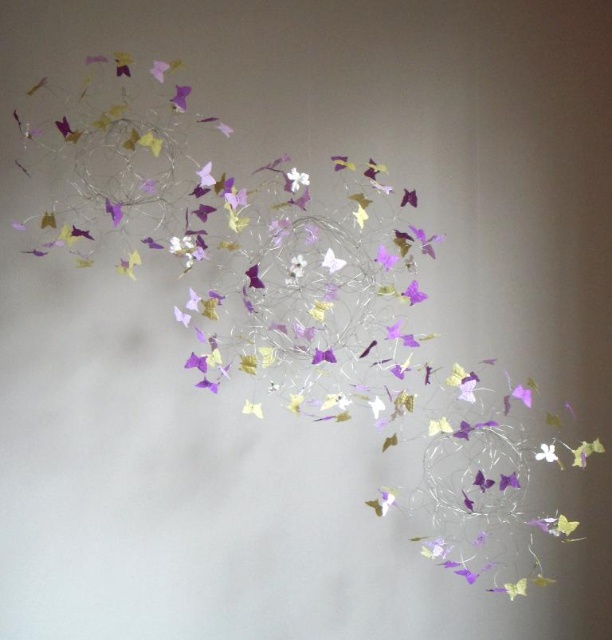
Question: Which point appears closest to the camera in this image?

Choices:
 (A) (296, 173)
 (B) (548, 449)

Answer: (B)

Question: Which of the following is the farthest from the observer?

Choices:
 (A) purple paper flower at upper left
 (B) white paper flower at center

Answer: (B)

Question: Which object is farther from the camera taking this photo?

Choices:
 (A) purple paper butterfly at center
 (B) purple paper flower at upper left
 (C) white paper flower at center

Answer: (C)

Question: Does white paper flower at center come behind purple paper flower at upper left?

Choices:
 (A) no
 (B) yes

Answer: (B)

Question: Does white paper flower at center appear on the left side of purple paper flower at upper left?

Choices:
 (A) no
 (B) yes

Answer: (A)

Question: From the image, what is the correct spatial relationship of purple paper flower at upper left in relation to purple paper butterfly at center?

Choices:
 (A) above
 (B) below

Answer: (A)